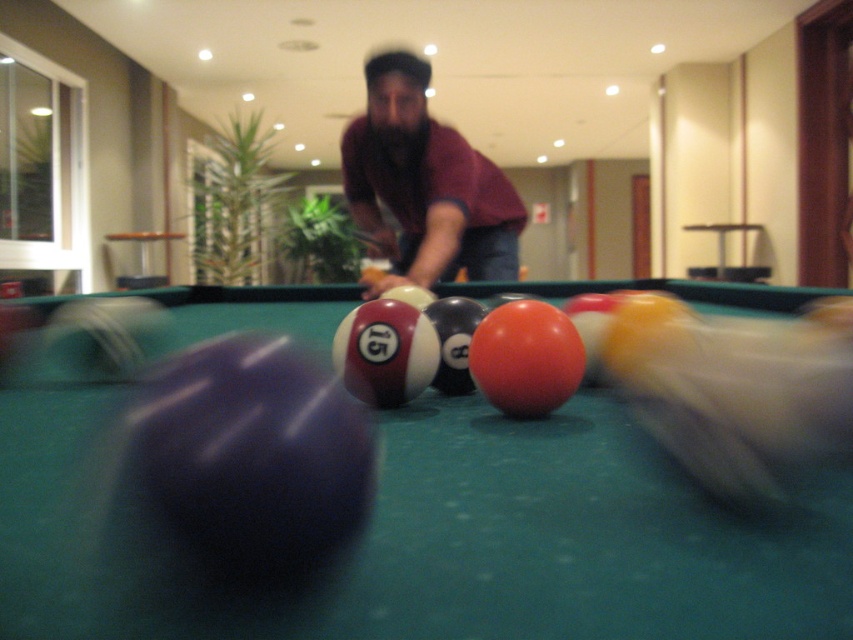
Does point (708, 307) lie behind point (415, 80)?

That is True.

Can you confirm if smooth green pool table at center is smaller than maroon shirt at center?

Yes, smooth green pool table at center is smaller than maroon shirt at center.

Image resolution: width=853 pixels, height=640 pixels. Identify the location of smooth green pool table at center. (457, 538).